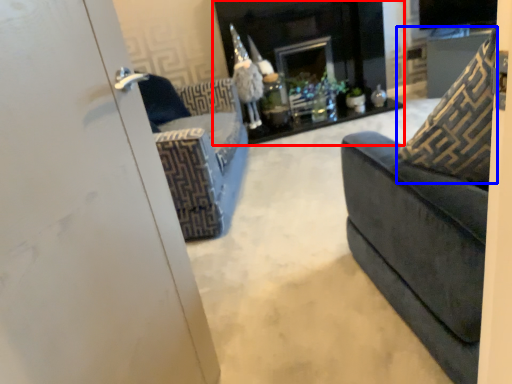
Question: Which object is further to the camera taking this photo, fireplace (highlighted by a red box) or throw pillow (highlighted by a blue box)?

Choices:
 (A) fireplace
 (B) throw pillow

Answer: (A)